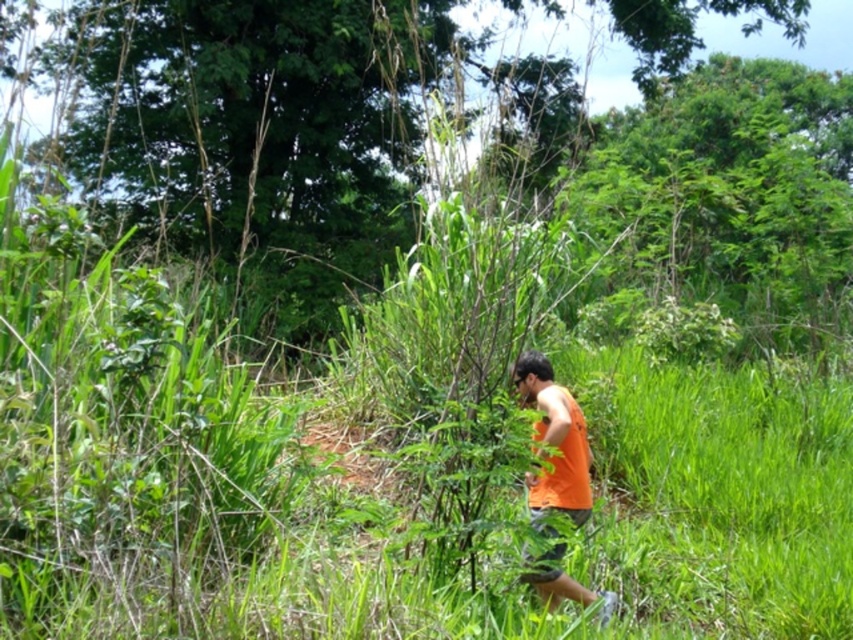
Does green leafy tree at center have a larger size compared to orange fabric shirt at center?

Yes.

Measure the distance between green leafy tree at center and camera.

green leafy tree at center is 13.63 feet from camera.

Is point (154, 186) positioned before point (567, 593)?

No, it is not.

You are a GUI agent. You are given a task and a screenshot of the screen. Output one action in this format:
    pyautogui.click(x=<x>, y=<y>)
    Task: Click on the green leafy tree at center
    
    Given the screenshot: What is the action you would take?
    pyautogui.click(x=254, y=120)